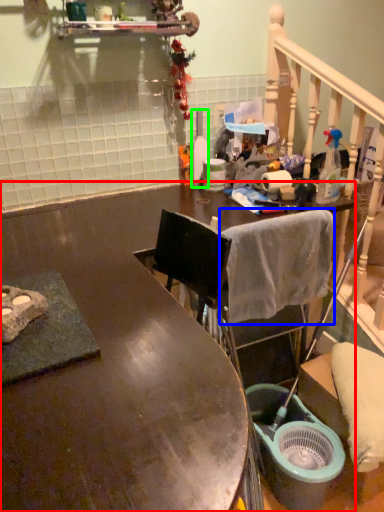
Question: Estimate the real-world distances between objects in this image. Which object is farther from desk (highlighted by a red box), bath towel (highlighted by a blue box) or bottle (highlighted by a green box)?

Choices:
 (A) bath towel
 (B) bottle

Answer: (B)